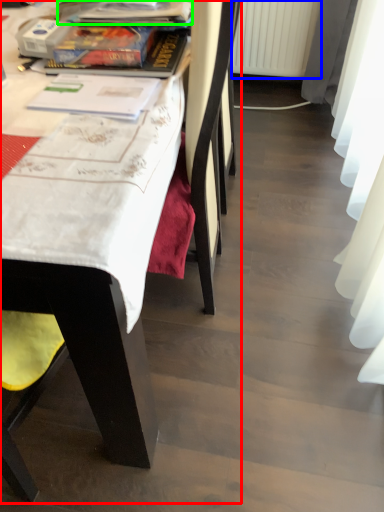
Question: Considering the real-world distances, which object is closest to chair (highlighted by a red box)? radiator (highlighted by a blue box) or book (highlighted by a green box).

Choices:
 (A) radiator
 (B) book

Answer: (B)